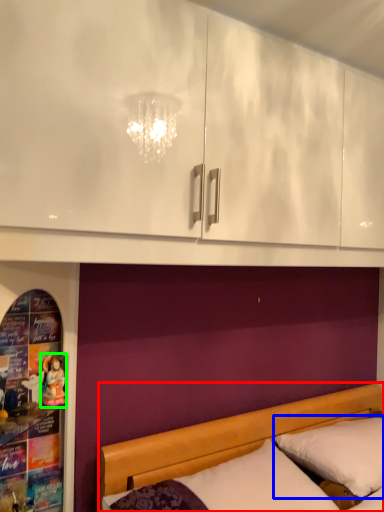
Question: Which object is positioned farthest from bed (highlighted by a red box)? Select from pillow (highlighted by a blue box) and doll (highlighted by a green box).

Choices:
 (A) pillow
 (B) doll

Answer: (B)